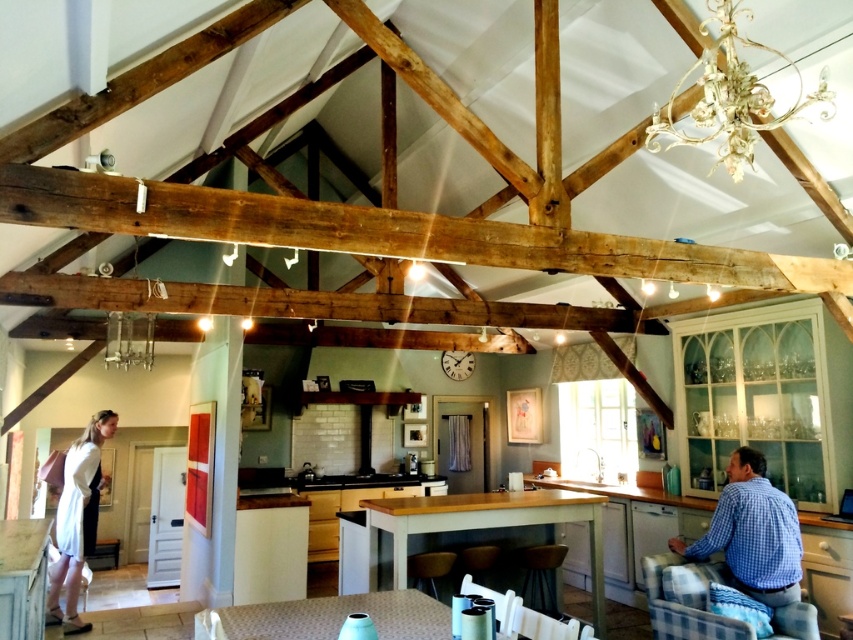
Question: Among these points, which one is nearest to the camera?

Choices:
 (A) (79, 461)
 (B) (732, 13)

Answer: (B)

Question: Does blue checkered shirt at lower right have a larger size compared to white cotton dress at lower left?

Choices:
 (A) yes
 (B) no

Answer: (B)

Question: Does blue checkered shirt at lower right have a lesser width compared to metallic glass chandelier at upper center?

Choices:
 (A) yes
 (B) no

Answer: (A)

Question: Which object appears closest to the camera in this image?

Choices:
 (A) white ornate chandelier at upper right
 (B) blue checkered shirt at lower right
 (C) white cotton dress at lower left
 (D) metallic glass chandelier at upper center

Answer: (A)

Question: Which of the following is the farthest from the observer?

Choices:
 (A) white ornate chandelier at upper right
 (B) blue checkered shirt at lower right

Answer: (B)

Question: Can you confirm if blue checkered shirt at lower right is positioned above white cotton dress at lower left?

Choices:
 (A) no
 (B) yes

Answer: (B)